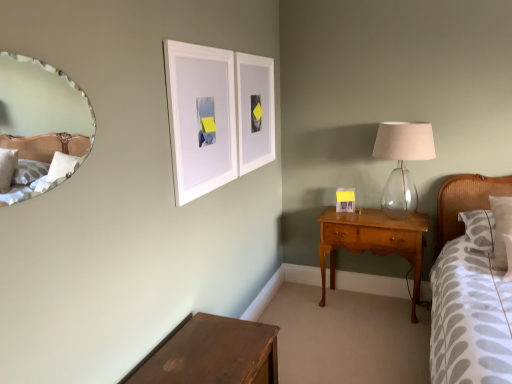
At what (x,y) coordinates should I click in order to perform the action: click on matte white picture frame at right, marked as the first picture frame in a right-to-left arrangement. Please return your answer as a coordinate pair (x, y). This screenshot has height=384, width=512. Looking at the image, I should click on (345, 200).

Measure the distance between point [245,367] and camera.

Point [245,367] is 5.54 feet from camera.

Describe the element at coordinates (40, 126) in the screenshot. The image size is (512, 384). I see `silver-framed mirror at left` at that location.

What do you see at coordinates (402, 162) in the screenshot? The height and width of the screenshot is (384, 512). I see `clear glass lampshade at right` at bounding box center [402, 162].

Find the location of `matte white picture frame at right, which is the 1th picture frame in back-to-front order`. matte white picture frame at right, which is the 1th picture frame in back-to-front order is located at coordinates (345, 200).

In terms of height, does dark brown wooden table at lower left look taller or shorter compared to white matte picture frame at upper center, which is counted as the second picture frame, starting from the back?

Considering their sizes, dark brown wooden table at lower left has less height than white matte picture frame at upper center, which is counted as the second picture frame, starting from the back.

Does dark brown wooden table at lower left touch white matte picture frame at upper center, the second picture frame viewed from the front?

There is a gap between dark brown wooden table at lower left and white matte picture frame at upper center, the second picture frame viewed from the front.

Does dark brown wooden table at lower left have a smaller size compared to white matte picture frame at upper center, which is counted as the second picture frame, starting from the back?

Actually, dark brown wooden table at lower left might be larger than white matte picture frame at upper center, which is counted as the second picture frame, starting from the back.

Is white textured pillow at right directly adjacent to dark brown wooden table at lower left?

No, white textured pillow at right is not with dark brown wooden table at lower left.

Is white textured pillow at right located outside dark brown wooden table at lower left?

white textured pillow at right lies outside dark brown wooden table at lower left's area.

From the image's perspective, which one is positioned higher, white textured pillow at right or dark brown wooden table at lower left?

From the image's view, white textured pillow at right is above.

Looking at this image, who is smaller, white textured pillow at right or dark brown wooden table at lower left?

white textured pillow at right.

Does matte white picture frame at right, which ranks as the 3th picture frame in front-to-back order, come in front of clear glass lampshade at right?

No.

Is matte white picture frame at right, which is the 1th picture frame in back-to-front order, positioned with its back to clear glass lampshade at right?

No, matte white picture frame at right, which is the 1th picture frame in back-to-front order, is not facing the opposite direction of clear glass lampshade at right.

Measure the distance from matte white picture frame at right, which is the 1th picture frame in back-to-front order, to clear glass lampshade at right.

A distance of 23.08 inches exists between matte white picture frame at right, which is the 1th picture frame in back-to-front order, and clear glass lampshade at right.

Between matte white picture frame at right, the 3th picture frame from the left, and clear glass lampshade at right, which one appears on the right side from the viewer's perspective?

clear glass lampshade at right is more to the right.

Who is bigger, white textured pillow at right or light brown wood nightstand at center right?

Bigger between the two is light brown wood nightstand at center right.

Which of these two, white textured pillow at right or light brown wood nightstand at center right, stands taller?

light brown wood nightstand at center right is taller.

From a real-world perspective, is white textured pillow at right physically located above or below light brown wood nightstand at center right?

Clearly, from a real-world perspective, white textured pillow at right is above light brown wood nightstand at center right.

Is light brown wood nightstand at center right surrounded by white textured pillow at right?

No, light brown wood nightstand at center right is not inside white textured pillow at right.

How much distance is there between matte white picture frame at right, marked as the first picture frame in a right-to-left arrangement, and silver-framed mirror at left?

matte white picture frame at right, marked as the first picture frame in a right-to-left arrangement, and silver-framed mirror at left are 2.80 meters apart.

From the image's perspective, is matte white picture frame at right, marked as the first picture frame in a right-to-left arrangement, located beneath silver-framed mirror at left?

Indeed, from the image's perspective, matte white picture frame at right, marked as the first picture frame in a right-to-left arrangement, is shown beneath silver-framed mirror at left.

Looking at this image, between matte white picture frame at right, the 3th picture frame from the left, and silver-framed mirror at left, which one has smaller size?

matte white picture frame at right, the 3th picture frame from the left.

Is white textured pillow at right inside clear glass lampshade at right?

No, white textured pillow at right is not surrounded by clear glass lampshade at right.

Is point (388, 199) closer to viewer compared to point (476, 245)?

No.

Considering the sizes of clear glass lampshade at right and white textured pillow at right in the image, is clear glass lampshade at right bigger or smaller than white textured pillow at right?

Considering their sizes, clear glass lampshade at right takes up more space than white textured pillow at right.

Who is taller, white matte picture frame at upper center, marked as the first picture frame in a front-to-back arrangement, or white textured pillow at right?

Standing taller between the two is white matte picture frame at upper center, marked as the first picture frame in a front-to-back arrangement.

Between white matte picture frame at upper center, acting as the 3th picture frame starting from the back, and white textured pillow at right, which one appears on the left side from the viewer's perspective?

white matte picture frame at upper center, acting as the 3th picture frame starting from the back, is more to the left.

Where is `pillow that is below the white matte picture frame at upper center, marked as the first picture frame in a front-to-back arrangement (from the image's perspective)`? This screenshot has width=512, height=384. pillow that is below the white matte picture frame at upper center, marked as the first picture frame in a front-to-back arrangement (from the image's perspective) is located at coordinates (479, 228).

Is white matte picture frame at upper center, acting as the first picture frame starting from the left, aimed at white textured pillow at right?

No, white matte picture frame at upper center, acting as the first picture frame starting from the left, does not turn towards white textured pillow at right.

From the image's perspective, starting from the dark brown wooden table at lower left, which picture frame is the 3rd one above? Please provide its 2D coordinates.

[(254, 111)]

This screenshot has width=512, height=384. I want to click on table lying below the white textured pillow at right (from the image's perspective), so tap(213, 353).

Based on their spatial positions, is light brown wood nightstand at center right or matte white picture frame at right, the 3th picture frame from the left, closer to clear glass lampshade at right?

Among the two, matte white picture frame at right, the 3th picture frame from the left, is located nearer to clear glass lampshade at right.

Considering their positions, is light brown wood nightstand at center right positioned further to matte white picture frame at right, which is the 1th picture frame in back-to-front order, than silver-framed mirror at left?

silver-framed mirror at left.

From the image, which object appears to be farther from dark brown wooden table at lower left, white matte picture frame at upper center, acting as the first picture frame starting from the left, or white matte picture frame at upper center, the second picture frame in the left-to-right sequence?

white matte picture frame at upper center, the second picture frame in the left-to-right sequence, is positioned further to the anchor dark brown wooden table at lower left.

Which object lies nearer to the anchor point matte white picture frame at right, which is the 1th picture frame in back-to-front order, light brown wood nightstand at center right or dark brown wooden table at lower left?

light brown wood nightstand at center right is positioned closer to the anchor matte white picture frame at right, which is the 1th picture frame in back-to-front order.

From the image, which object appears to be farther from clear glass lampshade at right, white matte picture frame at upper center, the second picture frame viewed from the front, or light brown wood nightstand at center right?

white matte picture frame at upper center, the second picture frame viewed from the front, is further to clear glass lampshade at right.

When comparing their distances from clear glass lampshade at right, does matte white picture frame at right, which ranks as the 3th picture frame in front-to-back order, or white matte picture frame at upper center, the second picture frame in the left-to-right sequence, seem further?

Based on the image, white matte picture frame at upper center, the second picture frame in the left-to-right sequence, appears to be further to clear glass lampshade at right.

Which object lies nearer to the anchor point white matte picture frame at upper center, acting as the first picture frame starting from the left, white matte picture frame at upper center, which is counted as the second picture frame, starting from the back, or white textured pillow at right?

white matte picture frame at upper center, which is counted as the second picture frame, starting from the back.

Which object lies further to the anchor point silver-framed mirror at left, clear glass lampshade at right or matte white picture frame at right, which ranks as the 3th picture frame in front-to-back order?

The object further to silver-framed mirror at left is clear glass lampshade at right.

This screenshot has width=512, height=384. I want to click on table between white matte picture frame at upper center, marked as the first picture frame in a front-to-back arrangement, and clear glass lampshade at right, so click(x=213, y=353).

This screenshot has width=512, height=384. I want to click on table lamp located between silver-framed mirror at left and white textured pillow at right in the left-right direction, so click(402, 162).

Locate an element on the screen. table located between silver-framed mirror at left and white textured pillow at right in the left-right direction is located at coordinates (213, 353).

Where is `picture frame between clear glass lampshade at right and light brown wood nightstand at center right vertically`? picture frame between clear glass lampshade at right and light brown wood nightstand at center right vertically is located at coordinates (345, 200).